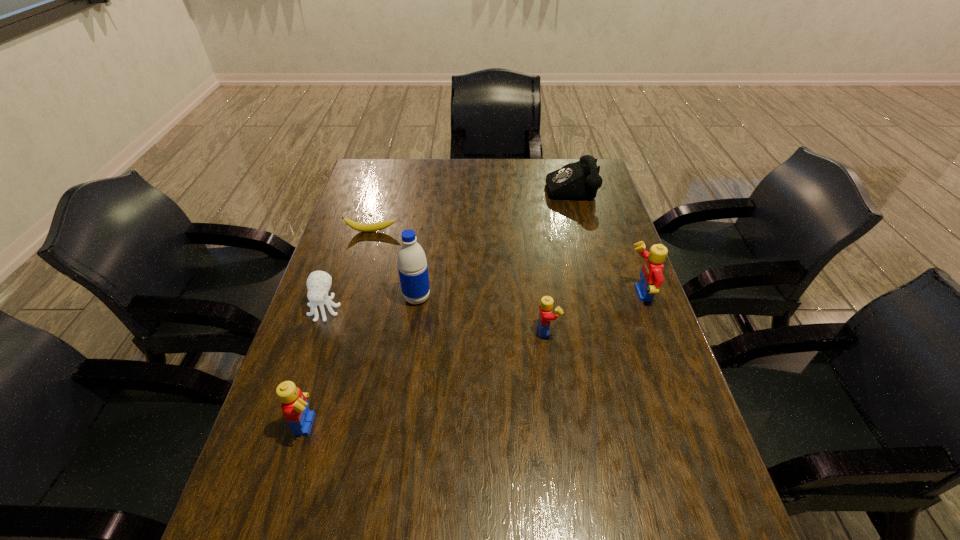
In order to click on vacant region located 0.170m on the right of the water bottle in this screenshot , I will do `click(492, 298)`.

The image size is (960, 540). Identify the location of free space located 0.050m on the front-facing side of the octopus. (315, 339).

At what (x,y) coordinates should I click in order to perform the action: click on object that is at the far edge. Please return your answer as a coordinate pair (x, y). Image resolution: width=960 pixels, height=540 pixels. Looking at the image, I should click on (577, 181).

The image size is (960, 540). I want to click on Lego present at the left edge, so click(x=294, y=405).

In order to click on banana that is at the left edge in this screenshot , I will do `click(362, 227)`.

You are a GUI agent. You are given a task and a screenshot of the screen. Output one action in this format:
    pyautogui.click(x=<x>, y=<y>)
    Task: Click on the octopus that is at the left edge
    
    Given the screenshot: What is the action you would take?
    click(318, 283)

This screenshot has height=540, width=960. Identify the location of Lego at the right edge. point(651,275).

Identify the location of telephone at the right edge. This screenshot has height=540, width=960. pos(577,181).

You are a GUI agent. You are given a task and a screenshot of the screen. Output one action in this format:
    pyautogui.click(x=<x>, y=<y>)
    Task: Click on the object located in the far right corner section of the desktop
    This screenshot has width=960, height=540.
    Given the screenshot: What is the action you would take?
    pyautogui.click(x=577, y=181)

Identify the location of vacant region at the far edge of the desktop. (488, 185).